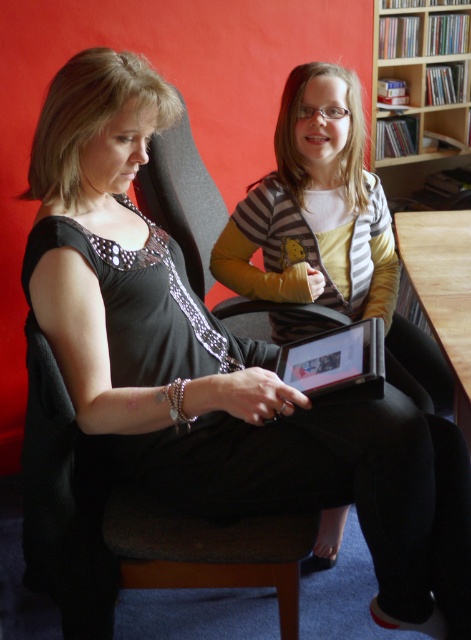
Question: Can you confirm if striped sweater at center is smaller than wooden bookshelf at upper right?

Choices:
 (A) no
 (B) yes

Answer: (B)

Question: Which is farther from the wooden bookshelf at upper right?

Choices:
 (A) black plastic tablet at center
 (B) striped sweater at center

Answer: (A)

Question: Among these objects, which one is farthest from the camera?

Choices:
 (A) wooden bookshelf at upper right
 (B) striped sweater at center

Answer: (A)

Question: Does striped sweater at center appear on the right side of black plastic tablet at center?

Choices:
 (A) no
 (B) yes

Answer: (A)

Question: Which of the following is the closest to the observer?

Choices:
 (A) (305, 372)
 (B) (438, 125)

Answer: (A)

Question: Does striped sweater at center appear on the right side of wooden bookshelf at upper right?

Choices:
 (A) yes
 (B) no

Answer: (B)